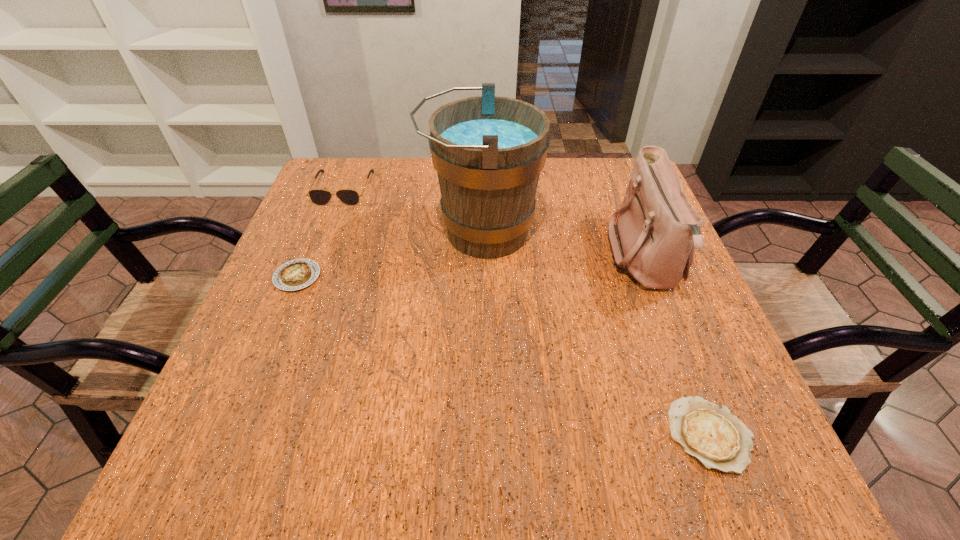
Identify the location of vacant space positioned on the front pocket of the shoulder bag. (570, 259).

Locate an element on the screen. The image size is (960, 540). vacant space situated 0.320m on the front pocket of the shoulder bag is located at coordinates (468, 259).

The image size is (960, 540). Identify the location of free space located on the front pocket of the shoulder bag. (526, 259).

The height and width of the screenshot is (540, 960). Find the location of `free spot located 0.170m on the front-facing side of the sunglasses`. free spot located 0.170m on the front-facing side of the sunglasses is located at coordinates (319, 249).

At what (x,y) coordinates should I click in order to perform the action: click on free space located on the back of the farther quiche. Please return your answer as a coordinate pair (x, y). The height and width of the screenshot is (540, 960). Looking at the image, I should click on (317, 230).

Identify the location of vacant space situated 0.190m on the left of the nearest object. The width and height of the screenshot is (960, 540). (550, 435).

Find the location of a particular element. This screenshot has width=960, height=540. wine bucket that is at the far edge is located at coordinates (488, 151).

Image resolution: width=960 pixels, height=540 pixels. In order to click on sunglasses that is at the far edge in this screenshot , I will do `click(320, 197)`.

The width and height of the screenshot is (960, 540). I want to click on object that is at the near edge, so (x=711, y=433).

Find the location of a particular element. The height and width of the screenshot is (540, 960). sunglasses that is at the left edge is located at coordinates (320, 197).